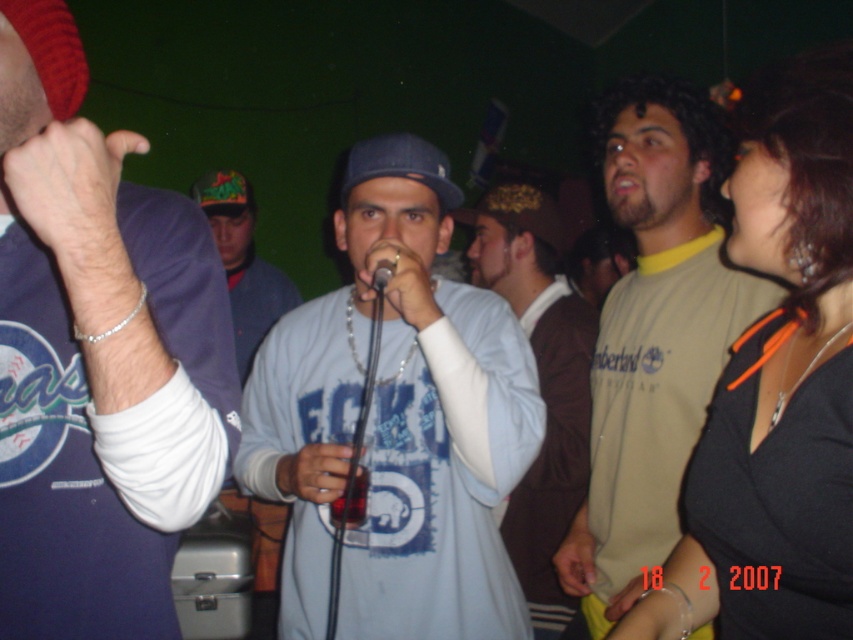
Can you confirm if matte blue sweatshirt at center is bigger than light blue cotton shirt at center?

No, matte blue sweatshirt at center is not bigger than light blue cotton shirt at center.

Between point (77, 179) and point (294, 356), which one is positioned in front?

Point (77, 179) is in front.

In order to click on matte blue sweatshirt at center in this screenshot , I will do `click(96, 356)`.

Does green fabric cap at center have a smaller size compared to black metallic microphone at center?

No.

Who is shorter, green fabric cap at center or black metallic microphone at center?

With less height is black metallic microphone at center.

Where is `green fabric cap at center`? The height and width of the screenshot is (640, 853). green fabric cap at center is located at coordinates (242, 262).

Who is higher up, matte blue sweatshirt at center or light brown t-shirt at center?

matte blue sweatshirt at center is higher up.

Find the location of a particular element. Image resolution: width=853 pixels, height=640 pixels. matte blue sweatshirt at center is located at coordinates (96, 356).

Locate an element on the screen. matte blue sweatshirt at center is located at coordinates (96, 356).